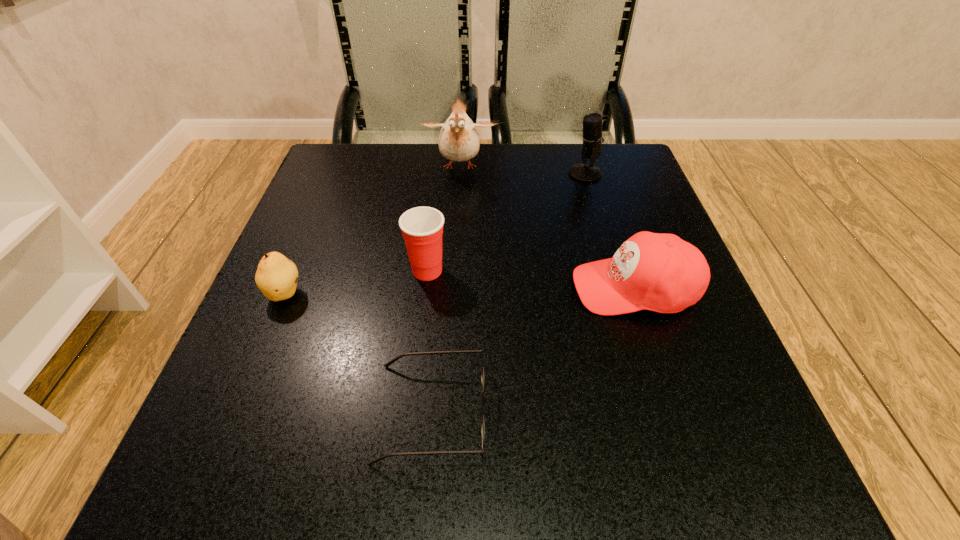
Identify the location of free region located on the front of the Dixie cup. (402, 483).

Where is `vacant space located 0.060m on the front panel of the baseball cap`? vacant space located 0.060m on the front panel of the baseball cap is located at coordinates (539, 288).

Where is `vacant space located on the front panel of the baseball cap`? The image size is (960, 540). vacant space located on the front panel of the baseball cap is located at coordinates (348, 288).

Find the location of a particular element. This screenshot has width=960, height=540. vacant area situated on the front panel of the baseball cap is located at coordinates (420, 288).

In order to click on blank space located on the back of the pear in this screenshot , I will do `click(325, 197)`.

Locate an element on the screen. Image resolution: width=960 pixels, height=540 pixels. blank area located 0.360m on the front-facing side of the nearest object is located at coordinates pos(740,413).

Locate an element on the screen. This screenshot has height=540, width=960. bird that is at the far edge is located at coordinates (458, 141).

Locate an element on the screen. Image resolution: width=960 pixels, height=540 pixels. microphone that is at the far edge is located at coordinates (592, 137).

This screenshot has height=540, width=960. Find the location of `object at the near edge`. object at the near edge is located at coordinates (389, 363).

I want to click on object at the left edge, so click(x=276, y=276).